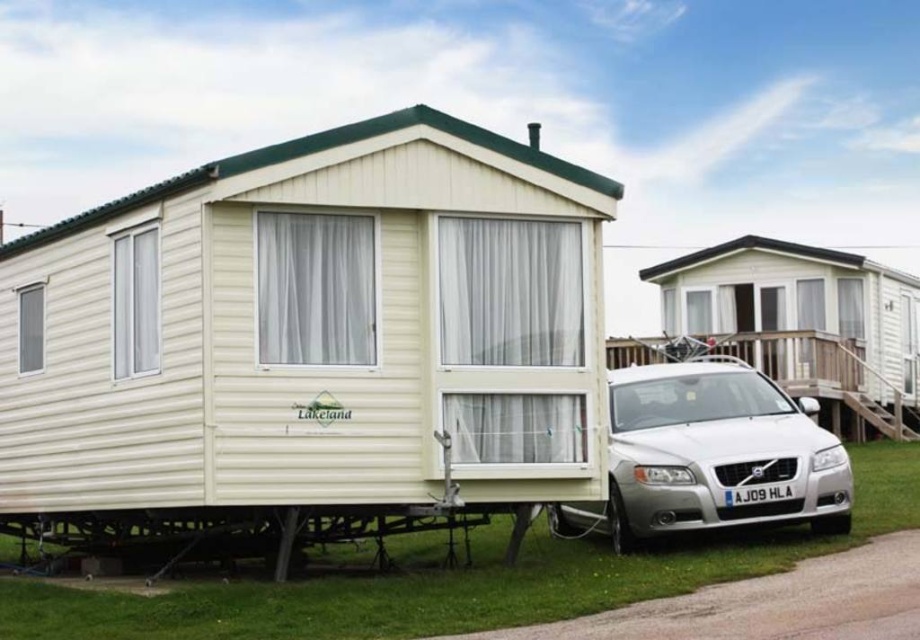
Question: Which point is closer to the camera?

Choices:
 (A) beige vinyl camper at center
 (B) silver metallic car at lower right

Answer: (A)

Question: Does beige vinyl camper at center appear over silver metallic car at lower right?

Choices:
 (A) yes
 (B) no

Answer: (A)

Question: Does beige vinyl camper at center have a smaller size compared to silver metallic car at lower right?

Choices:
 (A) yes
 (B) no

Answer: (A)

Question: Does beige vinyl camper at center appear on the left side of silver metallic car at lower right?

Choices:
 (A) yes
 (B) no

Answer: (A)